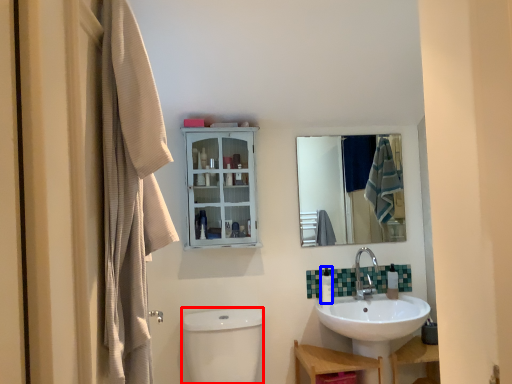
Question: Which of the following is the closest to the observer, toilet bowl (highlighted by a red box) or toiletry (highlighted by a blue box)?

Choices:
 (A) toilet bowl
 (B) toiletry

Answer: (A)